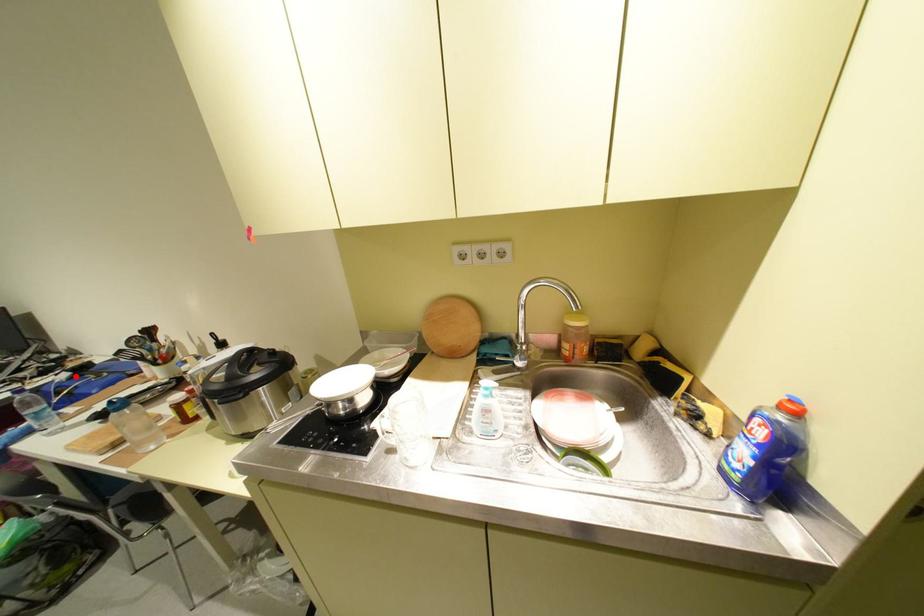
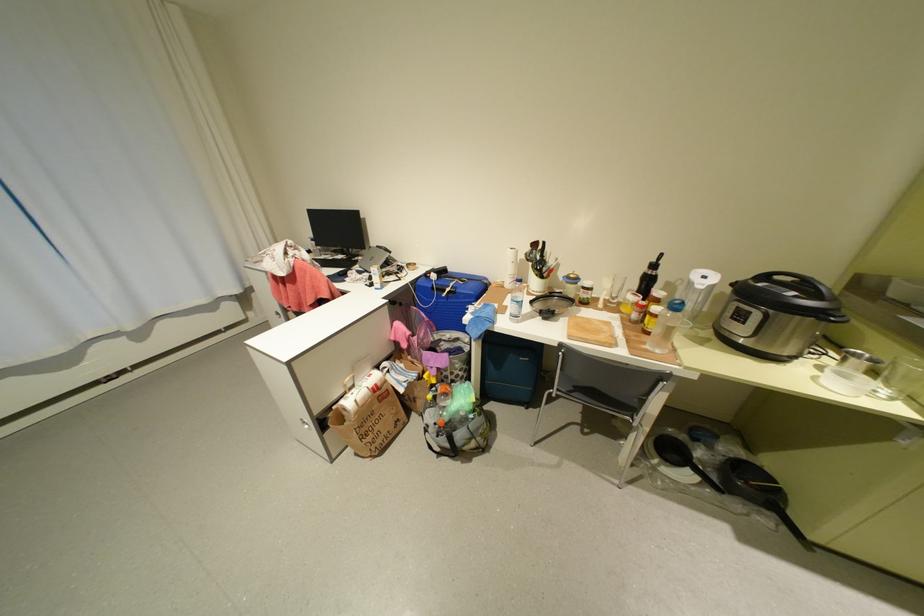
In the second image, find the point that corresponds to the highlighted location in the first image.

(444, 276)